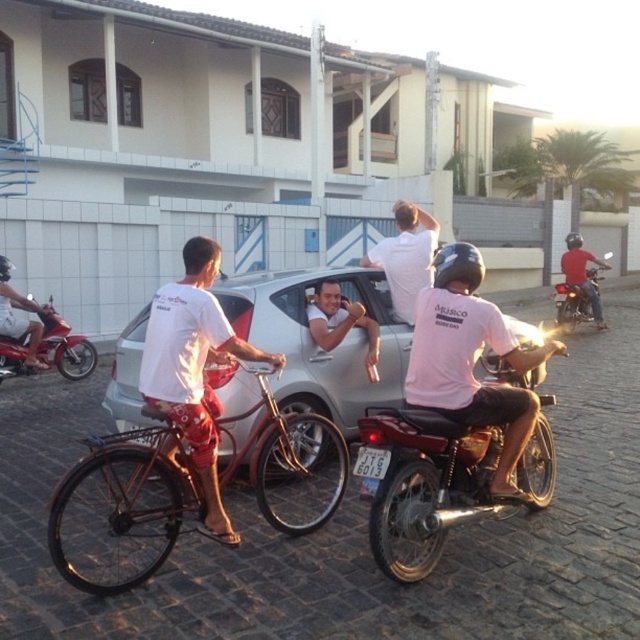
You are a pedestrian standing on the cobblestone street and want to cross to the other side. The shiny metallic motorcycle at center and the brushed metal bicycle at left are blocking your path. Which object is closer to you so you can step around it first?

The brushed metal bicycle at left is closer to you since the shiny metallic motorcycle at center is positioned under it, meaning the bicycle is above the motorcycle in the image, suggesting it is closer to the observer.

You are a tourist standing on the cobblestone street and want to take a photo of the pink matte helmet at center and the white matte shirt at upper center. Which object should you focus on first to ensure both are in focus?

You should focus on the pink matte helmet at center first because it is closer to you than the white matte shirt at upper center. By focusing on the closer object, the background object will still be in focus due to the depth of field.

You are a delivery person who needs to place a package between the pink matte helmet at center and the white matte shirt at upper center. Can you fit the package there if it measures 2 meters in length?

The distance between the pink matte helmet at center and the white matte shirt at upper center is 2.15 meters, so yes, the package can fit as it is shorter than the available space.